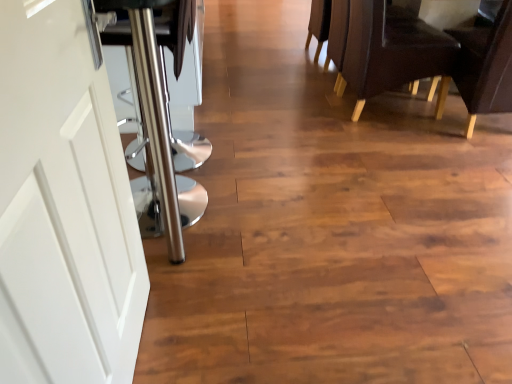
Where is `leather-like dark brown chair at right, which is the 2th chair from right to left`? leather-like dark brown chair at right, which is the 2th chair from right to left is located at coordinates (391, 51).

The width and height of the screenshot is (512, 384). What do you see at coordinates (63, 207) in the screenshot? I see `white matte door at left` at bounding box center [63, 207].

Where is `white matte door at left`? The image size is (512, 384). white matte door at left is located at coordinates (63, 207).

Find the location of a particular element. This screenshot has width=512, height=384. leather-like dark brown chair at right, which is the 2th chair from right to left is located at coordinates (391, 51).

Is point (466, 128) positioned before point (56, 3)?

No, (466, 128) is behind (56, 3).

Considering their positions, is brown leather chair at upper right, the 2th chair when ordered from left to right, located in front of or behind white matte door at left?

brown leather chair at upper right, the 2th chair when ordered from left to right, is behind white matte door at left.

Based on the photo, which of these two, brown leather chair at upper right, marked as the 1th chair in a right-to-left arrangement, or white matte door at left, is wider?

Wider between the two is brown leather chair at upper right, marked as the 1th chair in a right-to-left arrangement.

From a real-world perspective, is brown leather chair at upper right, the 2th chair when ordered from left to right, below white matte door at left?

Yes, from a real-world perspective, brown leather chair at upper right, the 2th chair when ordered from left to right, is beneath white matte door at left.

Can you confirm if white matte door at left is taller than brown leather chair at upper right, marked as the 1th chair in a right-to-left arrangement?

Correct, white matte door at left is much taller as brown leather chair at upper right, marked as the 1th chair in a right-to-left arrangement.

What are the coordinates of `door below the brown leather chair at upper right, marked as the 1th chair in a right-to-left arrangement (from the image's perspective)` in the screenshot? It's located at (63, 207).

Are white matte door at left and brown leather chair at upper right, the 2th chair when ordered from left to right, far apart?

white matte door at left is far away from brown leather chair at upper right, the 2th chair when ordered from left to right.

Between white matte door at left and brown leather chair at upper right, the 2th chair when ordered from left to right, which one has smaller size?

Smaller between the two is white matte door at left.

Is leather-like dark brown chair at right, the 1th chair from the left, positioned with its back to white matte door at left?

That's not correct — leather-like dark brown chair at right, the 1th chair from the left, is not looking away from white matte door at left.

Relative to white matte door at left, is leather-like dark brown chair at right, which is the 2th chair from right to left, in front or behind?

In the image, leather-like dark brown chair at right, which is the 2th chair from right to left, appears behind white matte door at left.

Is leather-like dark brown chair at right, the 1th chair from the left, to the right of white matte door at left from the viewer's perspective?

Indeed, leather-like dark brown chair at right, the 1th chair from the left, is positioned on the right side of white matte door at left.

Considering the sizes of objects brown leather chair at upper right, marked as the 1th chair in a right-to-left arrangement, and leather-like dark brown chair at right, which is the 2th chair from right to left, in the image provided, who is smaller, brown leather chair at upper right, marked as the 1th chair in a right-to-left arrangement, or leather-like dark brown chair at right, which is the 2th chair from right to left,?

Smaller between the two is leather-like dark brown chair at right, which is the 2th chair from right to left.

Which is nearer, [484,99] or [354,14]?

Point [484,99] is positioned closer to the camera compared to point [354,14].

In order to click on chair above the brown leather chair at upper right, marked as the 1th chair in a right-to-left arrangement (from the image's perspective) in this screenshot , I will do `click(391, 51)`.

Does point (440, 46) come farther from viewer compared to point (477, 66)?

Yes, point (440, 46) is farther from viewer.

Is leather-like dark brown chair at right, which is the 2th chair from right to left, closer to the viewer compared to brown leather chair at upper right, the 2th chair when ordered from left to right?

No, the depth of leather-like dark brown chair at right, which is the 2th chair from right to left, is greater than that of brown leather chair at upper right, the 2th chair when ordered from left to right.

Considering the relative sizes of leather-like dark brown chair at right, which is the 2th chair from right to left, and brown leather chair at upper right, marked as the 1th chair in a right-to-left arrangement, in the image provided, is leather-like dark brown chair at right, which is the 2th chair from right to left, wider than brown leather chair at upper right, marked as the 1th chair in a right-to-left arrangement,?

Yes.

Is leather-like dark brown chair at right, the 1th chair from the left, not close to brown leather chair at upper right, the 2th chair when ordered from left to right?

leather-like dark brown chair at right, the 1th chair from the left, is actually quite close to brown leather chair at upper right, the 2th chair when ordered from left to right.

From the image's perspective, between white matte door at left and leather-like dark brown chair at right, the 1th chair from the left, which one is located above?

leather-like dark brown chair at right, the 1th chair from the left, from the image's perspective.

Image resolution: width=512 pixels, height=384 pixels. I want to click on the 2nd chair behind the white matte door at left, so click(x=391, y=51).

Does point (84, 245) come farther from viewer compared to point (368, 1)?

No, (84, 245) is in front of (368, 1).

Which object is wider, white matte door at left or leather-like dark brown chair at right, which is the 2th chair from right to left?

leather-like dark brown chair at right, which is the 2th chair from right to left.

Where is `door lying on the left of brown leather chair at upper right, the 2th chair when ordered from left to right`? The image size is (512, 384). door lying on the left of brown leather chair at upper right, the 2th chair when ordered from left to right is located at coordinates (63, 207).

From the white matte door at left, count 1st chairs backward and point to it. Please provide its 2D coordinates.

[(485, 67)]

When comparing their distances from brown leather chair at upper right, marked as the 1th chair in a right-to-left arrangement, does white matte door at left or leather-like dark brown chair at right, which is the 2th chair from right to left, seem closer?

leather-like dark brown chair at right, which is the 2th chair from right to left.

When comparing their distances from brown leather chair at upper right, the 2th chair when ordered from left to right, does leather-like dark brown chair at right, the 1th chair from the left, or white matte door at left seem further?

Among the two, white matte door at left is located further to brown leather chair at upper right, the 2th chair when ordered from left to right.

Estimate the real-world distances between objects in this image. Which object is further from leather-like dark brown chair at right, which is the 2th chair from right to left, white matte door at left or brown leather chair at upper right, the 2th chair when ordered from left to right?

white matte door at left is positioned further to the anchor leather-like dark brown chair at right, which is the 2th chair from right to left.

Estimate the real-world distances between objects in this image. Which object is closer to white matte door at left, brown leather chair at upper right, the 2th chair when ordered from left to right, or leather-like dark brown chair at right, which is the 2th chair from right to left?

Based on the image, leather-like dark brown chair at right, which is the 2th chair from right to left, appears to be nearer to white matte door at left.

Estimate the real-world distances between objects in this image. Which object is further from leather-like dark brown chair at right, which is the 2th chair from right to left, brown leather chair at upper right, the 2th chair when ordered from left to right, or white matte door at left?

white matte door at left is further to leather-like dark brown chair at right, which is the 2th chair from right to left.

Considering their positions, is leather-like dark brown chair at right, which is the 2th chair from right to left, positioned further to white matte door at left than brown leather chair at upper right, marked as the 1th chair in a right-to-left arrangement?

Among the two, brown leather chair at upper right, marked as the 1th chair in a right-to-left arrangement, is located further to white matte door at left.

Find the location of `chair between white matte door at left and leather-like dark brown chair at right, which is the 2th chair from right to left, along the z-axis`. chair between white matte door at left and leather-like dark brown chair at right, which is the 2th chair from right to left, along the z-axis is located at coordinates (485, 67).